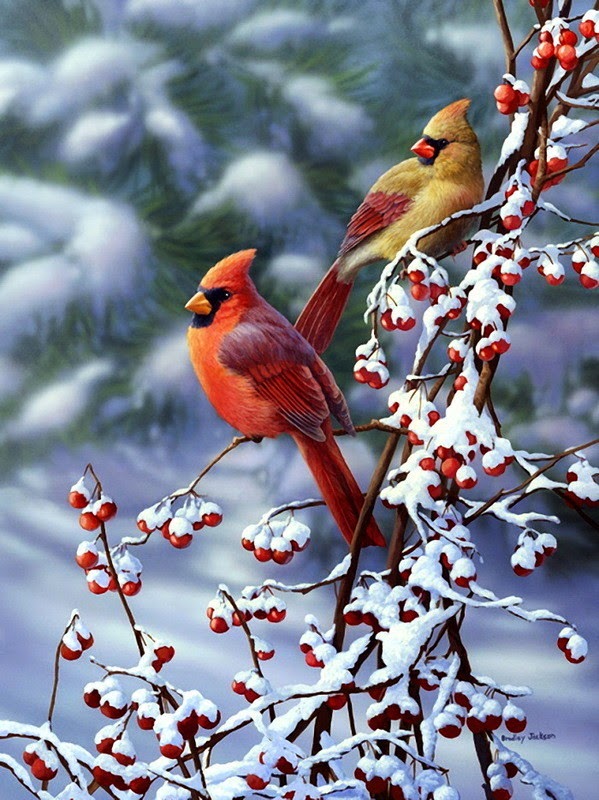
Where is `white shade`? This screenshot has width=599, height=800. white shade is located at coordinates (531, 672).